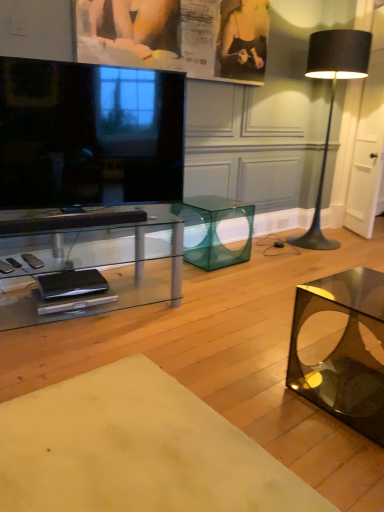
The width and height of the screenshot is (384, 512). In order to click on vacant space underneath polished black glass cube at lower right (from a real-world perspective) in this screenshot , I will do `click(358, 404)`.